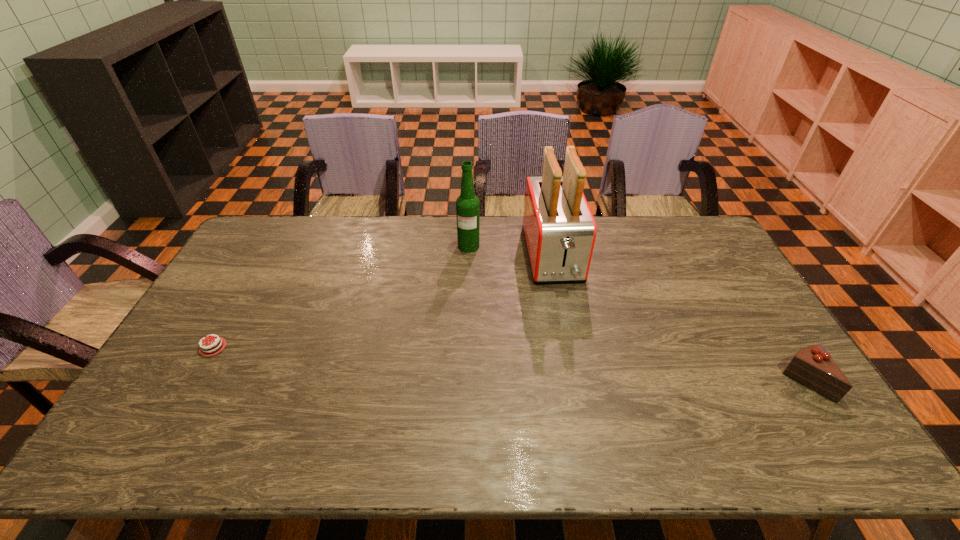
Locate an element on the screen. vacant space at the far edge of the desktop is located at coordinates (359, 217).

I want to click on vacant space at the near edge, so click(410, 389).

Find the location of a particular element. This screenshot has width=960, height=540. blank space at the left edge of the desktop is located at coordinates (268, 271).

In the image, there is a desktop. Identify the location of vacant space at the right edge. 759,320.

You are a GUI agent. You are given a task and a screenshot of the screen. Output one action in this format:
    pyautogui.click(x=<x>, y=<y>)
    Task: Click on the vacant space at the far right corner
    
    Given the screenshot: What is the action you would take?
    pyautogui.click(x=702, y=254)

The height and width of the screenshot is (540, 960). In order to click on vacant point located between the toaster and the leftmost object in this screenshot , I will do `click(383, 301)`.

This screenshot has width=960, height=540. In order to click on unoccupied area between the leftmost object and the third tallest object in this screenshot , I will do `click(509, 364)`.

Find the location of a particular element. This screenshot has width=960, height=540. vacant space that's between the taller chocolate cake and the second object from right to left is located at coordinates (679, 319).

Find the location of `empty space that is in between the shortest object and the toaster`. empty space that is in between the shortest object and the toaster is located at coordinates (383, 301).

Locate an element on the screen. free spot between the left chocolate cake and the second shortest object is located at coordinates (509, 364).